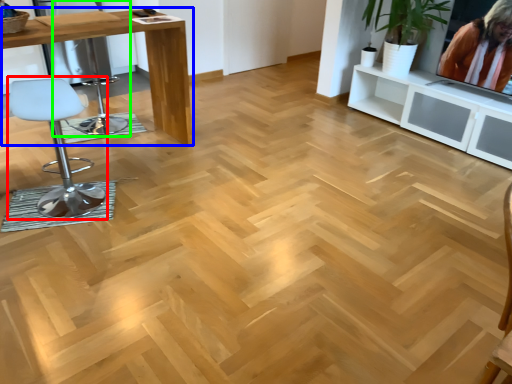
Question: Estimate the real-world distances between objects in this image. Which object is farther from chair (highlighted by a red box), table (highlighted by a blue box) or swivel chair (highlighted by a green box)?

Choices:
 (A) table
 (B) swivel chair

Answer: (B)